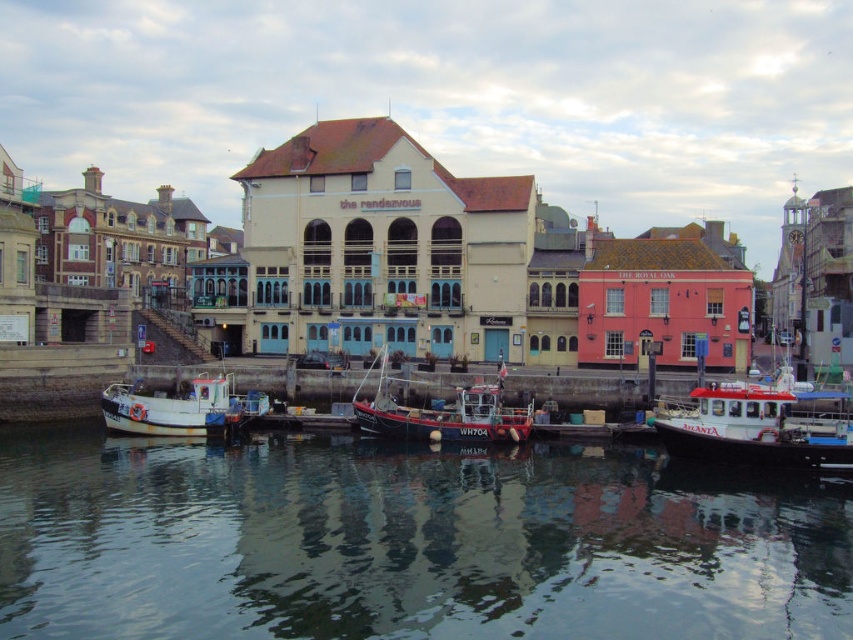
Question: Among these points, which one is farthest from the camera?

Choices:
 (A) (262, 566)
 (B) (764, 420)
 (C) (157, 388)

Answer: (C)

Question: Is transparent water at lower center above white plastic boat at right?

Choices:
 (A) yes
 (B) no

Answer: (B)

Question: Estimate the real-world distances between objects in this image. Which object is farther from the transparent water at lower center?

Choices:
 (A) white wooden boat at center
 (B) white plastic boat at right
 (C) wooden fishing boat at center

Answer: (A)

Question: Which of the following is the closest to the observer?

Choices:
 (A) white plastic boat at right
 (B) transparent water at lower center
 (C) wooden fishing boat at center

Answer: (B)

Question: Does white wooden boat at center appear over wooden fishing boat at center?

Choices:
 (A) yes
 (B) no

Answer: (B)

Question: Is white plastic boat at right wider than white wooden boat at center?

Choices:
 (A) no
 (B) yes

Answer: (B)